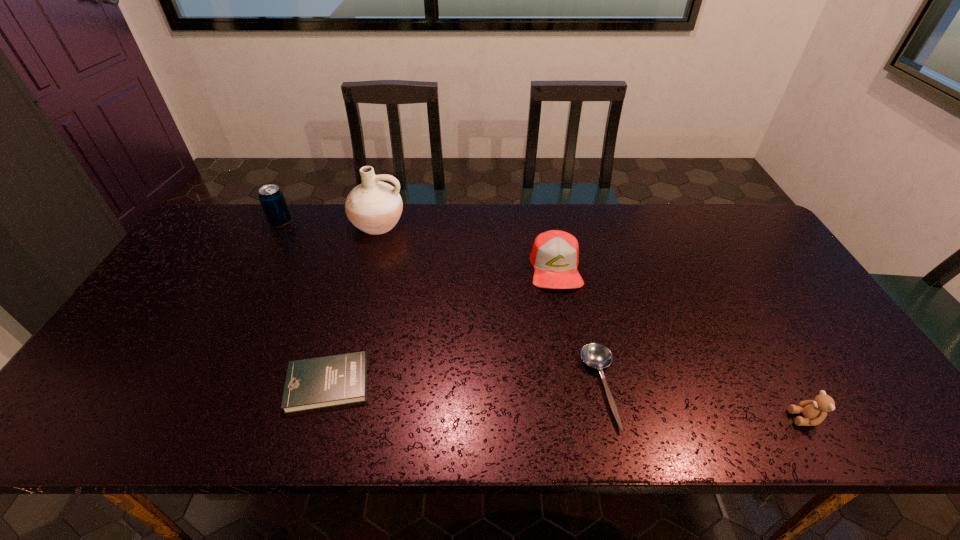
Find the location of a particular element. This screenshot has width=960, height=540. vacant space that satisfies the following two spatial constraints: 1. on the front-facing side of the ladle; 2. on the left side of the baseball cap is located at coordinates (577, 388).